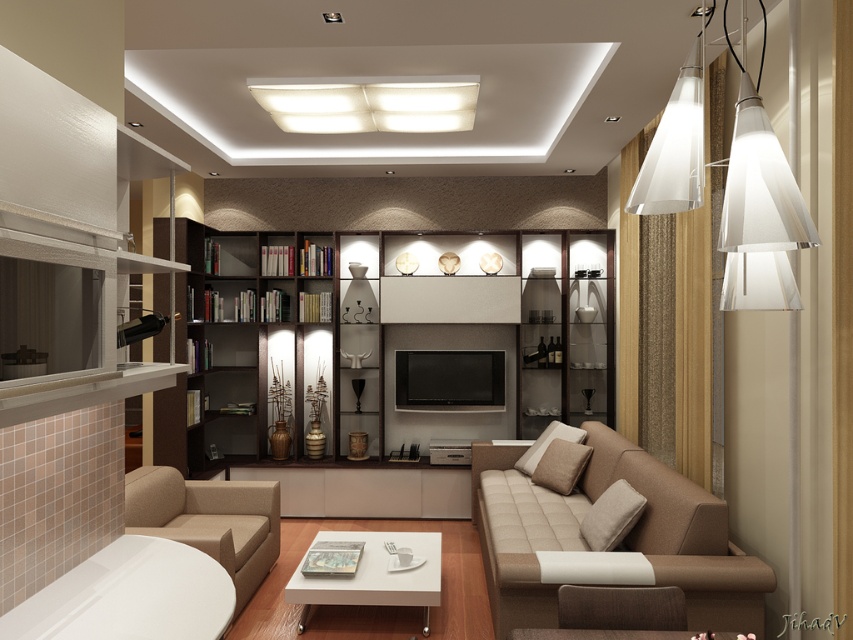
You are a furniture designer who wants to install a new shelf between the white matte rectangular light fixture at upper center and the white glossy coffee table at center. Based on their heights, which object should the shelf be placed closer to?

The shelf should be placed closer to the white matte rectangular light fixture at upper center because it has a lesser height compared to the white glossy coffee table at center, meaning the distance between them decreases as you move toward the fixture.

You are sitting on a sofa in the living room and want to place a book on the white glossy coffee table at center. Which direction should you look to see the white matte rectangular light fixture at upper center?

The white glossy coffee table at center is behind the white matte rectangular light fixture at upper center. Therefore, you should look forward towards the light fixture, which is in front of the coffee table.